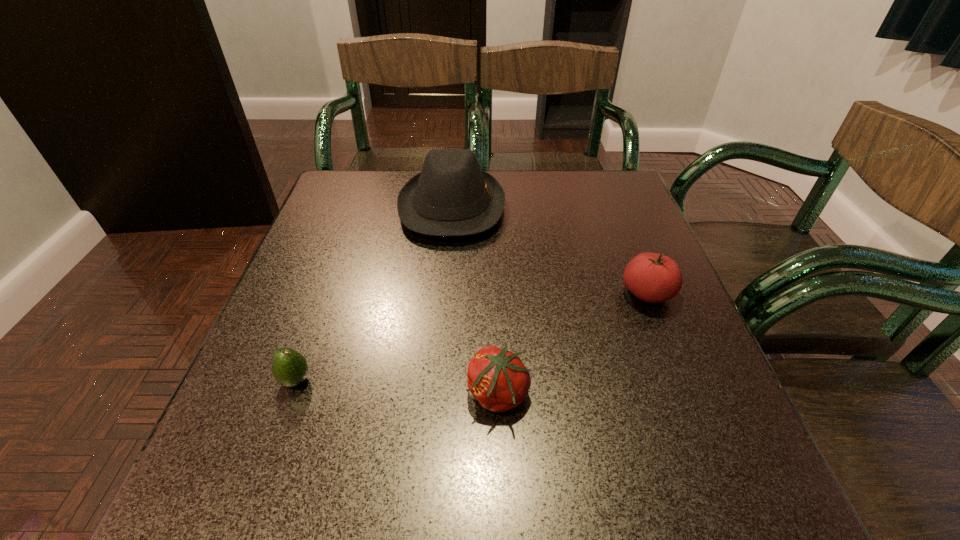
Find the location of a particular element. This screenshot has height=540, width=960. the farthest object is located at coordinates (451, 196).

I want to click on fedora, so click(451, 196).

Identify the location of the right tomato. (651, 277).

Where is `the second tallest object`? the second tallest object is located at coordinates (651, 277).

At what (x,y) coordinates should I click in order to perform the action: click on the nearer tomato. Please return your answer as a coordinate pair (x, y). This screenshot has width=960, height=540. Looking at the image, I should click on (497, 378).

Locate an element on the screen. The width and height of the screenshot is (960, 540). the left tomato is located at coordinates (497, 378).

Find the location of `avocado`. avocado is located at coordinates (289, 367).

You are a GUI agent. You are given a task and a screenshot of the screen. Output one action in this format:
    pyautogui.click(x=<x>, y=<y>)
    Task: Click on the free spot located on the front-facing side of the tallest object
    
    Given the screenshot: What is the action you would take?
    pyautogui.click(x=625, y=207)

Locate an element on the screen. free space located on the back of the farther tomato is located at coordinates (632, 254).

This screenshot has width=960, height=540. I want to click on blank area located on the right of the shorter tomato, so click(x=608, y=394).